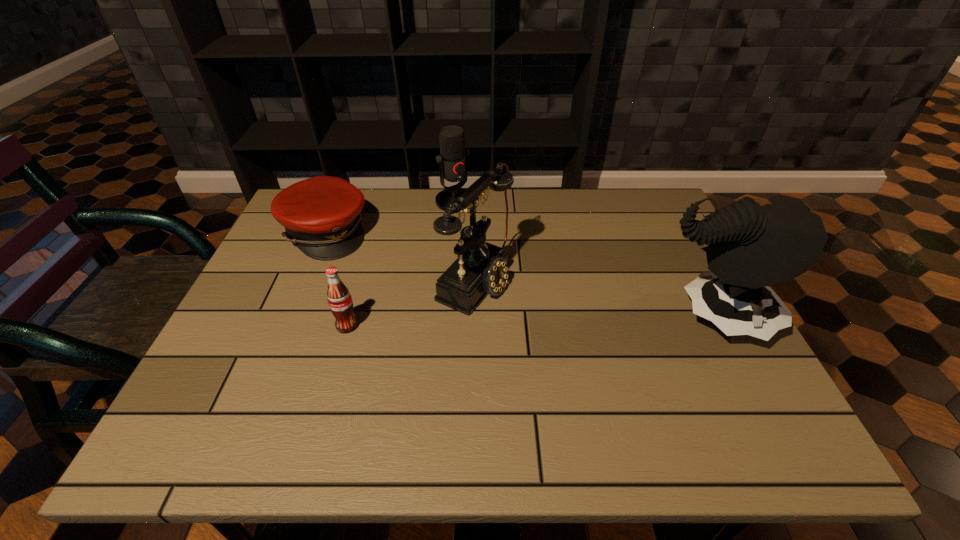
Locate an element on the screen. This screenshot has width=960, height=540. vacant space that is in between the fourth shortest object and the shortest object is located at coordinates (399, 255).

At what (x,y) coordinates should I click in order to perform the action: click on free spot between the telephone and the second shortest object. Please return your answer as a coordinate pair (x, y). Looking at the image, I should click on (411, 301).

Where is `free space that is in between the doll and the microphone`? This screenshot has height=540, width=960. free space that is in between the doll and the microphone is located at coordinates (583, 260).

At what (x,y) coordinates should I click in order to perform the action: click on empty space that is in between the telephone and the fourth tallest object. Please return your answer as a coordinate pair (x, y). This screenshot has height=540, width=960. Looking at the image, I should click on (411, 301).

Locate an element on the screen. unoccupied position between the microphone and the cap is located at coordinates (391, 217).

Identify which object is located as the nearest to the microphone. Please provide its 2D coordinates. Your answer should be formatted as a tuple, i.e. [(x, y)], where the tuple contains the x and y coordinates of a point satisfying the conditions above.

[(481, 268)]

Image resolution: width=960 pixels, height=540 pixels. In order to click on object that is the fourth closest one to the rightmost object in this screenshot , I will do `click(321, 215)`.

The image size is (960, 540). Identify the location of free spot that satisfies the following two spatial constraints: 1. on the front side of the fourth shortest object; 2. at the face of the doll. (473, 318).

In order to click on blank area in the image that satisfies the following two spatial constraints: 1. on the front side of the second tallest object; 2. at the face of the rightmost object in this screenshot , I will do `click(473, 318)`.